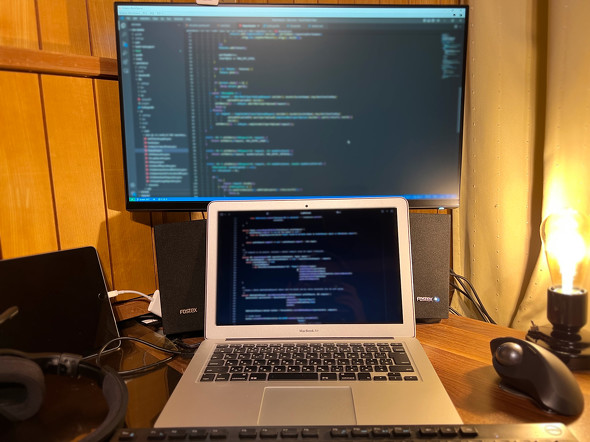
At what (x,y) coordinates should I click in order to perform the action: click on speakers. Please return your answer as a coordinate pair (x, y). Looking at the image, I should click on (430, 261), (191, 254).